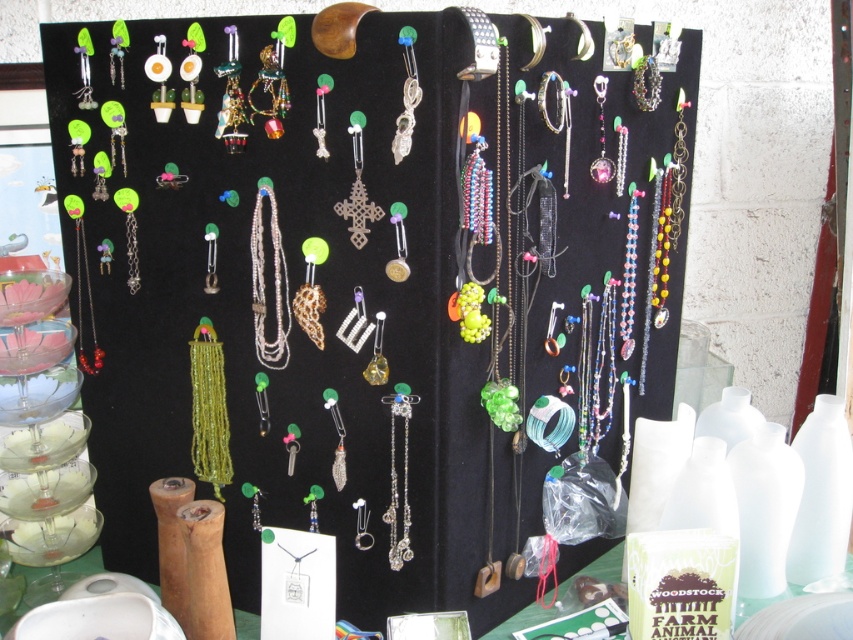
From the picture: How much distance is there between silver metallic chain at center and clear crystal pendant at center?

silver metallic chain at center is 5.30 inches away from clear crystal pendant at center.

Where is `silver metallic chain at center`? This screenshot has width=853, height=640. silver metallic chain at center is located at coordinates (264, 284).

Which is behind, point (283, 336) or point (393, 422)?

Positioned behind is point (283, 336).

You are a GUI agent. You are given a task and a screenshot of the screen. Output one action in this format:
    pyautogui.click(x=<x>, y=<y>)
    Task: Click on the silver metallic chain at center
    
    Given the screenshot: What is the action you would take?
    pyautogui.click(x=264, y=284)

Which is behind, point (195, 429) or point (392, 545)?

Point (195, 429)

I want to click on green beaded necklace at center, so click(207, 408).

Does green beaded necklace at center have a greater height compared to silver metallic chain at center?

Yes, green beaded necklace at center is taller than silver metallic chain at center.

Is green beaded necklace at center bigger than silver metallic chain at center?

Yes.

You are a GUI agent. You are given a task and a screenshot of the screen. Output one action in this format:
    pyautogui.click(x=<x>, y=<y>)
    Task: Click on the green beaded necklace at center
    
    Given the screenshot: What is the action you would take?
    pyautogui.click(x=207, y=408)

Image resolution: width=853 pixels, height=640 pixels. In order to click on green beaded necklace at center in this screenshot , I will do click(x=207, y=408).